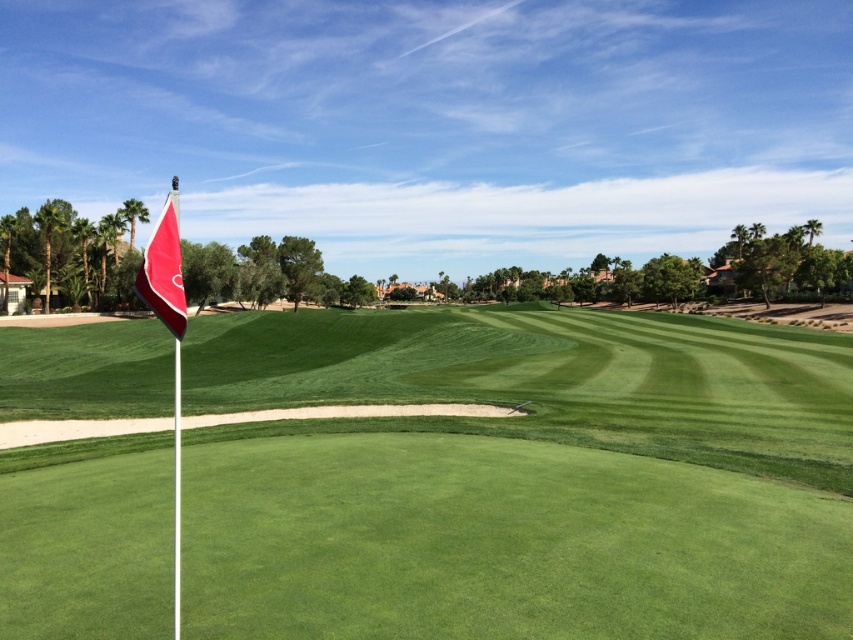
You are a golfer standing on the fairway and want to hit the ball towards the flag. Which object is closer to you, the green grass at center or the red matte flag at left?

The green grass at center is closer to you because it is further to the viewer than the red matte flag at left, meaning it appears nearer in the scene.

You are a golfer standing on the fairway and see the green grass at center and the red matte flag at left. Which object is positioned more to the left side of the image?

The red matte flag at left is positioned more to the left side of the image than the green grass at center.